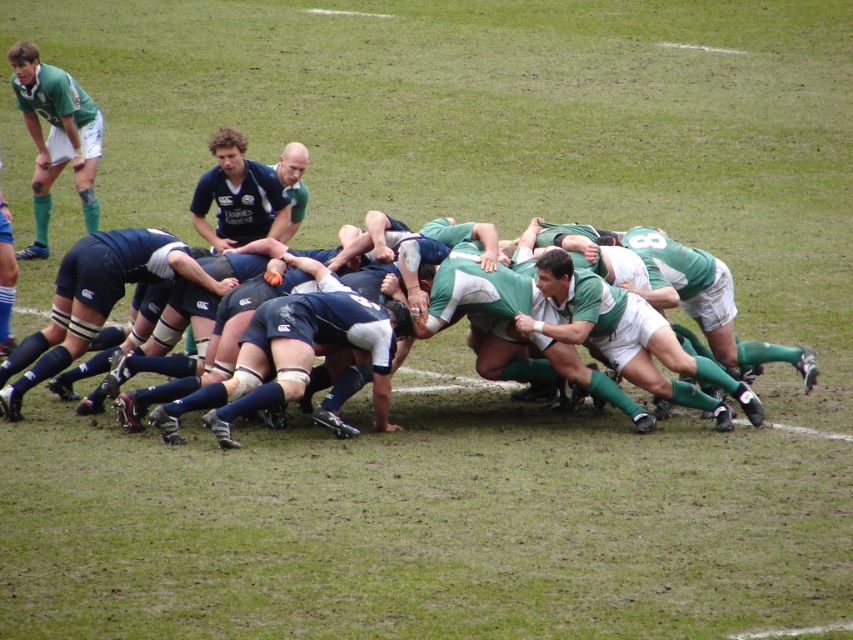
Question: Is dark blue jersey at center to the right of matte green shorts at upper left from the viewer's perspective?

Choices:
 (A) no
 (B) yes

Answer: (B)

Question: Estimate the real-world distances between objects in this image. Which object is farther from the green jersey at center?

Choices:
 (A) matte green shorts at upper left
 (B) dark blue jersey at center

Answer: (A)

Question: Does dark blue jersey at center appear over green jersey at center?

Choices:
 (A) no
 (B) yes

Answer: (A)

Question: Which point is closer to the camera taking this photo?

Choices:
 (A) (570, 296)
 (B) (157, 408)

Answer: (B)

Question: Considering the real-world distances, which object is farthest from the matte green shorts at upper left?

Choices:
 (A) green jersey at center
 (B) dark blue jersey at center

Answer: (A)

Question: Can you confirm if dark blue jersey at center is positioned to the left of matte green shorts at upper left?

Choices:
 (A) yes
 (B) no

Answer: (B)